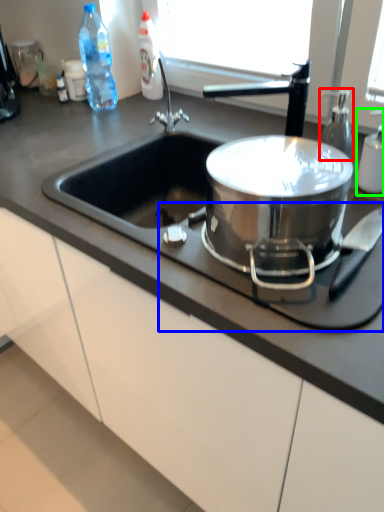
Question: Which is nearer to the soap dispenser (highlighted by a red box)? gas stove (highlighted by a blue box) or bottle (highlighted by a green box).

Choices:
 (A) gas stove
 (B) bottle

Answer: (B)